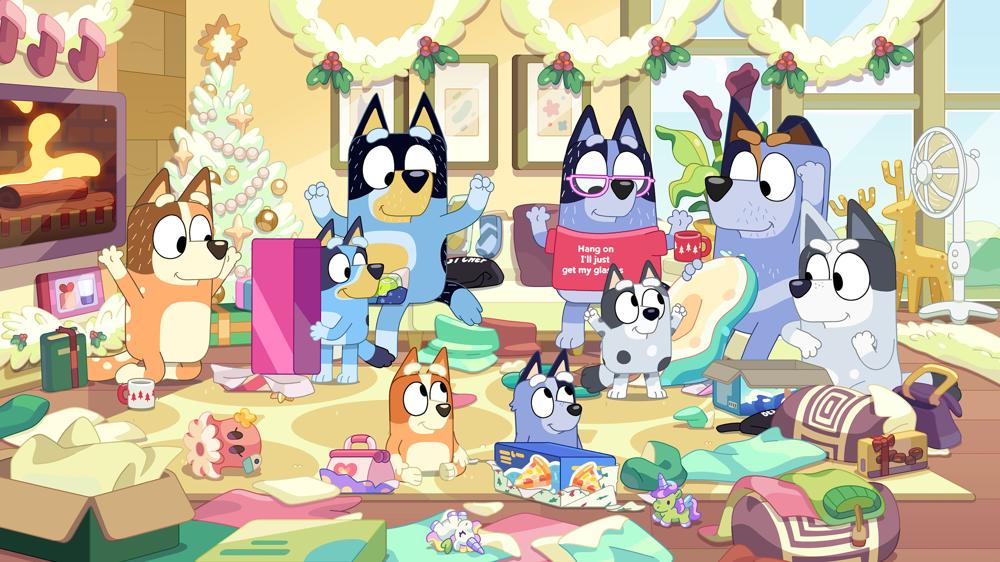
Identify the location of window. This screenshot has width=1000, height=562. (x=723, y=67), (x=862, y=108), (x=964, y=52).